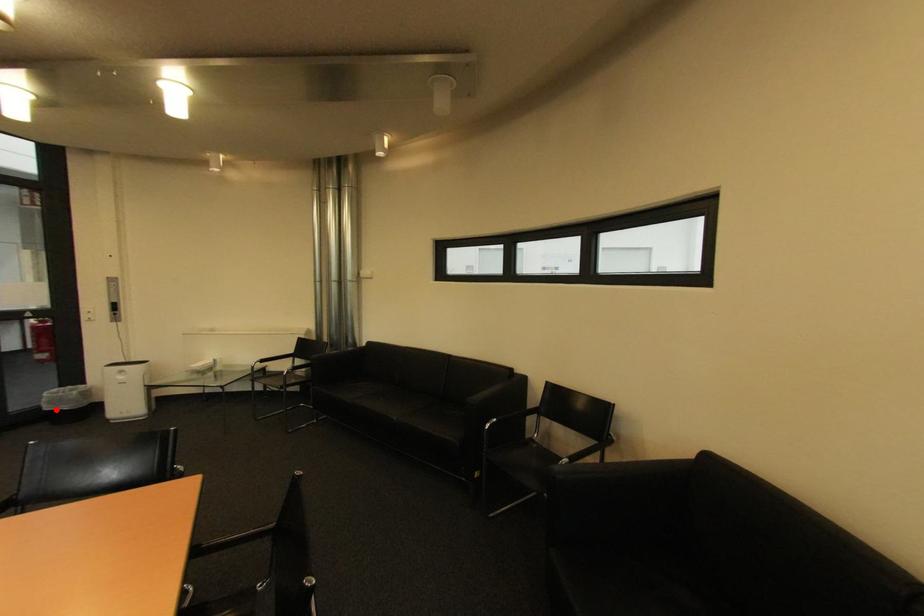
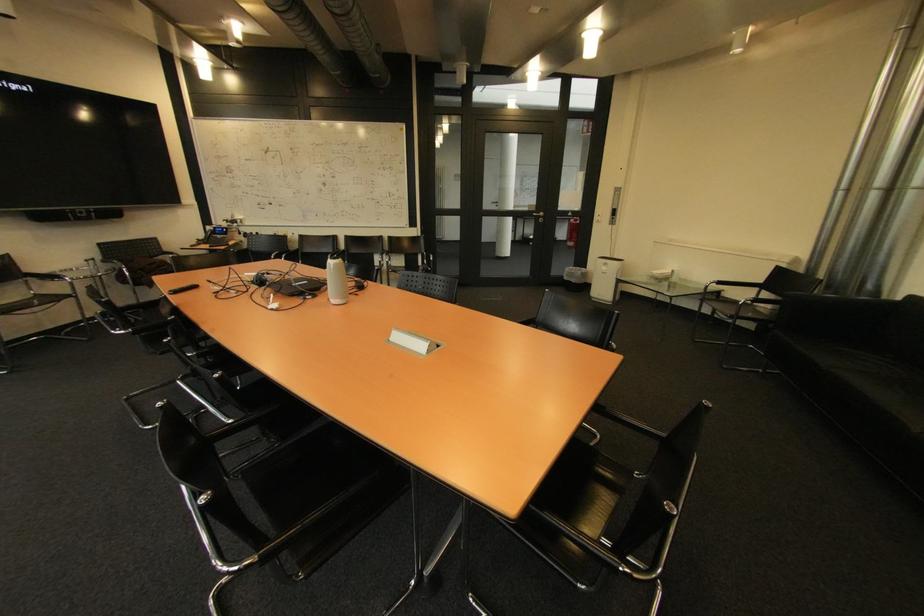
Where in the second image is the point corresponding to the highlighted location from the first image?

(574, 280)